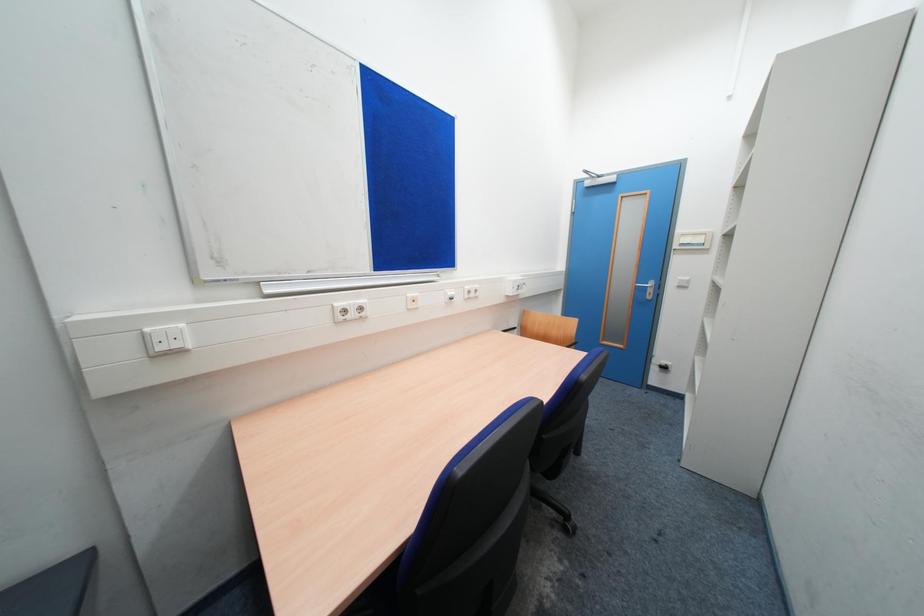
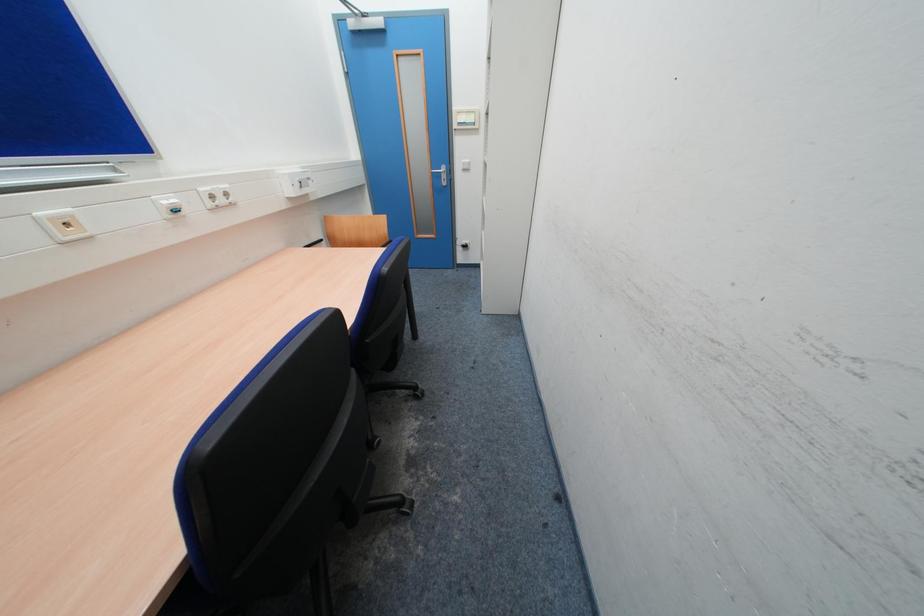
First-person continuous shooting, in which direction is the camera rotating?

The camera rotated toward right-down.